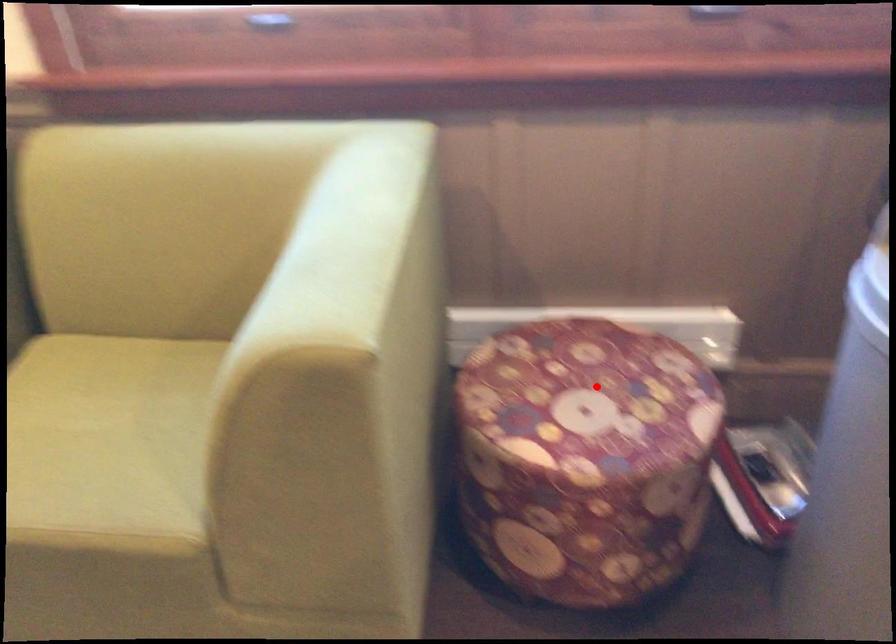
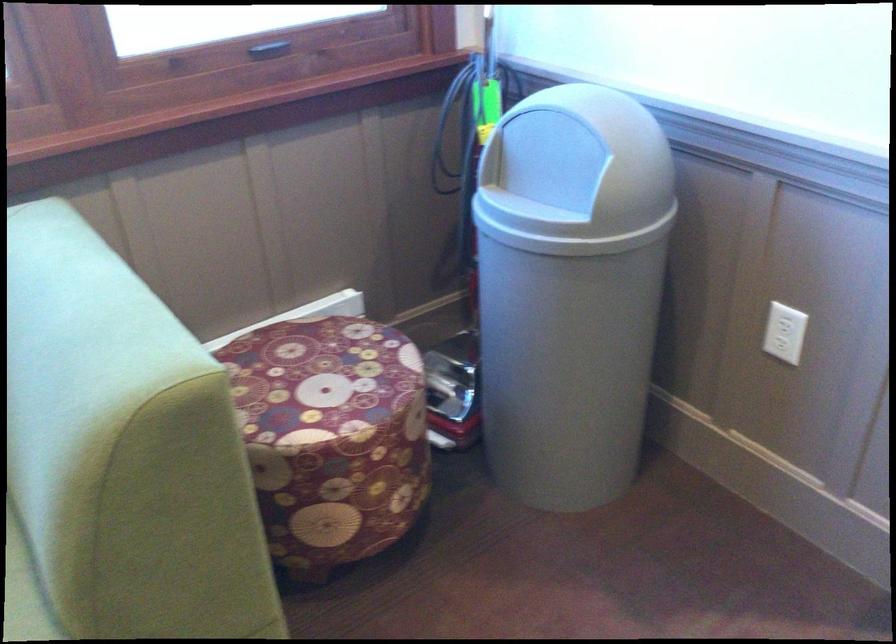
The point at the highlighted location is marked in the first image. Where is the corresponding point in the second image?

(320, 373)